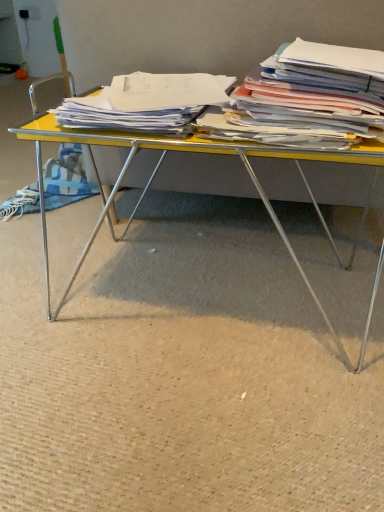
Question: Is white paper at center, the second magazine viewed from the right, bigger or smaller than yellow plastic desk at center?

Choices:
 (A) small
 (B) big

Answer: (A)

Question: In terms of height, does white paper at center, the second magazine viewed from the right, look taller or shorter compared to yellow plastic desk at center?

Choices:
 (A) short
 (B) tall

Answer: (A)

Question: Which object is positioned farthest from the white paper stack at right, which is the first magazine in right-to-left order?

Choices:
 (A) yellow plastic desk at center
 (B) white paper at center, the second magazine viewed from the right

Answer: (A)

Question: Which of these objects is positioned farthest from the yellow plastic desk at center?

Choices:
 (A) white paper stack at right, placed as the second magazine when sorted from left to right
 (B) white paper at center, which is the 1th magazine in left-to-right order

Answer: (A)